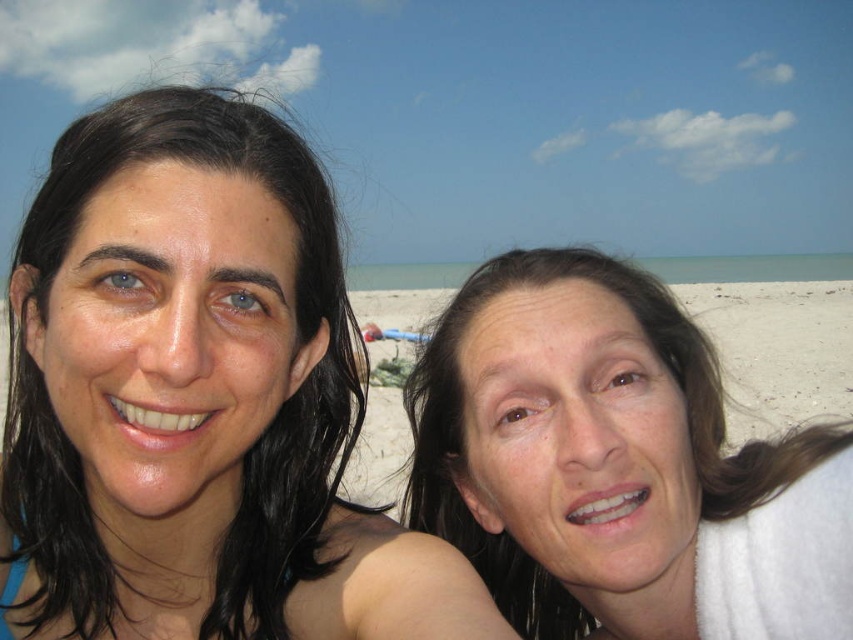
Is matte black hair at left positioned in front of smooth skin face at right?

Yes, matte black hair at left is closer to the viewer.

Can you confirm if matte black hair at left is positioned to the left of smooth skin face at right?

Yes, matte black hair at left is to the left of smooth skin face at right.

Is point (158, 124) more distant than point (685, 392)?

That is False.

In order to click on matte black hair at left in this screenshot , I will do `click(196, 400)`.